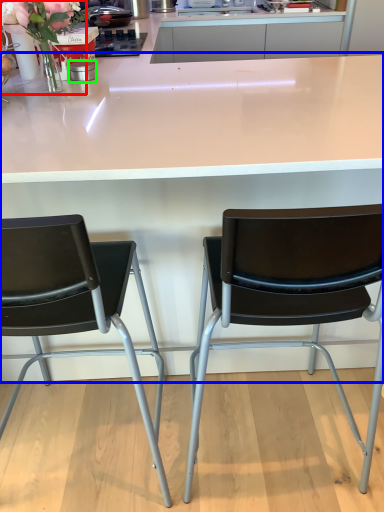
Question: Which is farther away from floral arrangement (highlighted by a red box)? table (highlighted by a blue box) or appliance (highlighted by a green box)?

Choices:
 (A) table
 (B) appliance

Answer: (A)